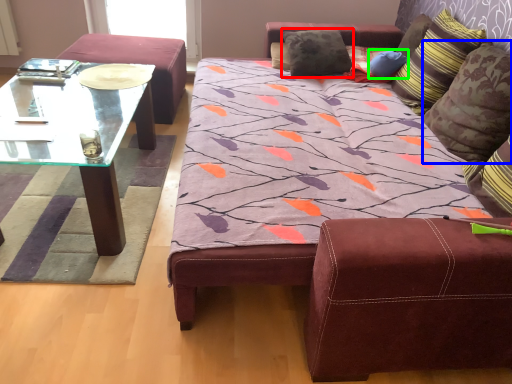
Question: Which object is positioned farthest from pillow (highlighted by a red box)? Select from pillow (highlighted by a blue box) and pillow (highlighted by a green box).

Choices:
 (A) pillow
 (B) pillow

Answer: (A)